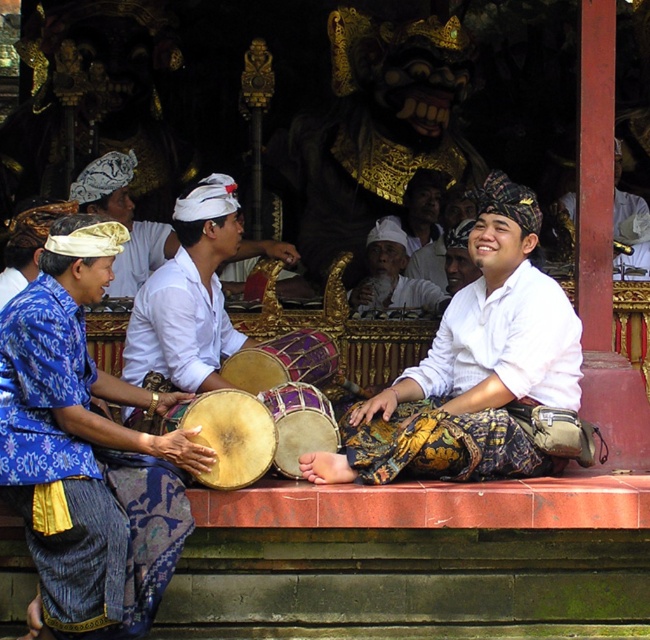
You are a photographer positioned in front of the raised platform where the performers are seated. You want to take a photo of the white cotton shirt at center and the white cotton shirt at right. Which shirt is positioned more to the left side of the platform?

The white cotton shirt at center is positioned more to the left side of the platform than the white cotton shirt at right.

You are a photographer standing in front of the temple. You want to take a photo that includes both the white cotton shirt at center and the natural wood drum at center. Which object should you focus on first if you want to ensure both are in frame without moving your camera?

The white cotton shirt at center has a larger size compared to natural wood drum at center, so you should focus on the white cotton shirt at center first to ensure both fit in the frame.

You are standing at the camera position and want to hand a flower to the person wearing the blue batik shirt at left. Considering the distance between you and them, is it possible to reach them without moving from your current position?

The blue batik shirt at left is 39.48 meters away from the camera, so it is not possible to reach them without moving from your current position.